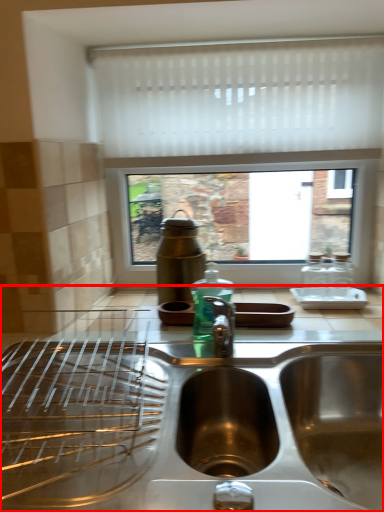
Question: From the image's perspective, what is the correct spatial relationship of countertop (annotated by the red box) in relation to curtain?

Choices:
 (A) below
 (B) above

Answer: (A)